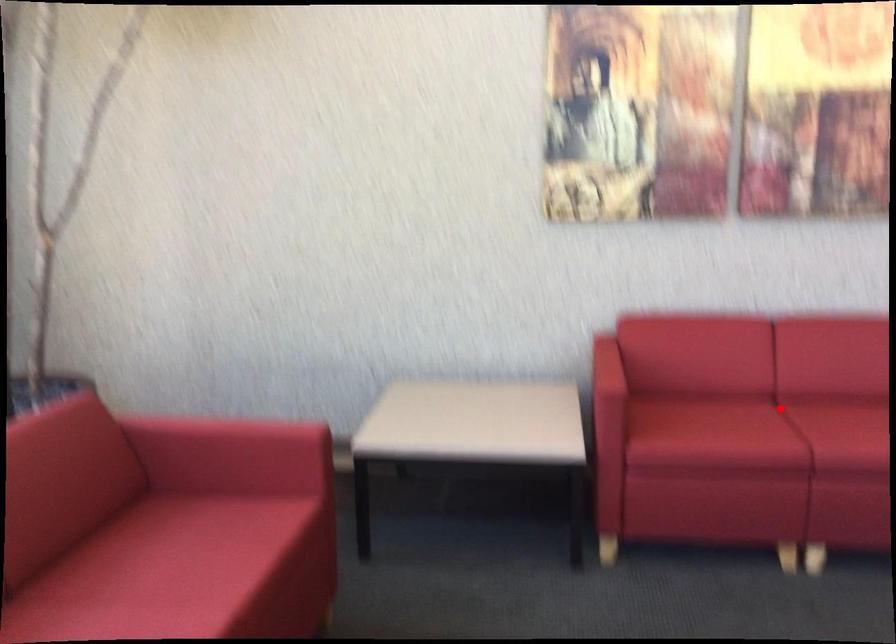
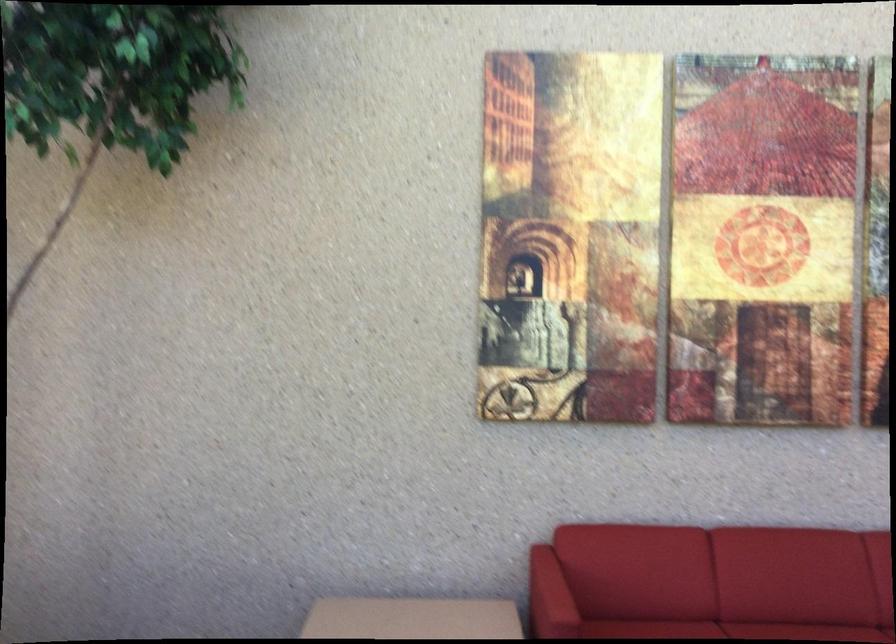
Locate, in the second image, the point that corresponds to the highlighted location in the first image.

(727, 630)